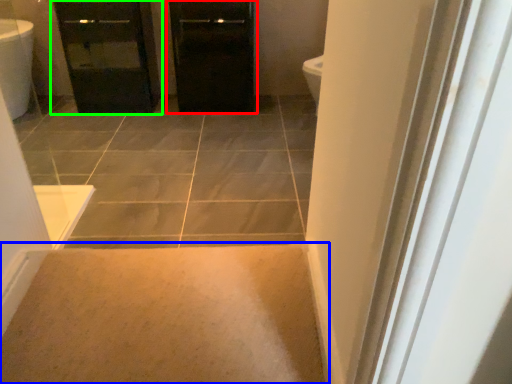
Question: Which is farther away from door (highlighted by a red box)? plain (highlighted by a blue box) or bathroom cabinet (highlighted by a green box)?

Choices:
 (A) plain
 (B) bathroom cabinet

Answer: (A)